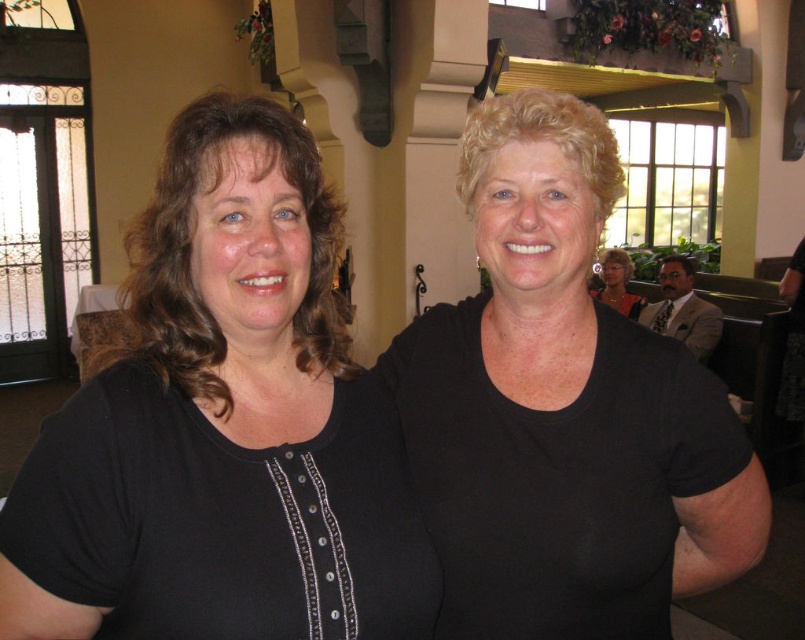
Does black matte shirt at upper right have a lesser width compared to matte black shirt at center?

No.

Is black matte shirt at upper right to the left of matte black shirt at center from the viewer's perspective?

Correct, you'll find black matte shirt at upper right to the left of matte black shirt at center.

Locate an element on the screen. The image size is (805, 640). black matte shirt at upper right is located at coordinates (564, 410).

Is point (137, 449) behind point (621, 298)?

No, it is in front of (621, 298).

Can you confirm if black knit shirt at center is wider than matte black shirt at center?

Indeed, black knit shirt at center has a greater width compared to matte black shirt at center.

Who is more forward, (153, 522) or (634, 307)?

Point (153, 522) is more forward.

Where is `black knit shirt at center`? This screenshot has height=640, width=805. black knit shirt at center is located at coordinates (221, 428).

From the picture: Is black knit shirt at center behind black matte shirt at upper right?

No, it is in front of black matte shirt at upper right.

Can you confirm if black knit shirt at center is smaller than black matte shirt at upper right?

Yes.

Which is in front, point (349, 580) or point (618, 618)?

Point (349, 580) is more forward.

The height and width of the screenshot is (640, 805). In order to click on black knit shirt at center in this screenshot , I will do `click(221, 428)`.